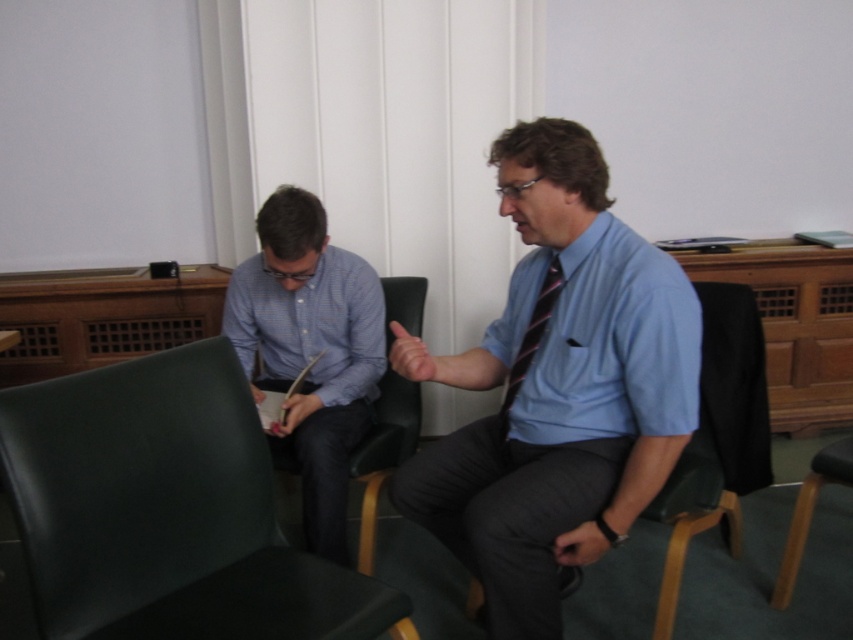
Question: Does matte black swivel chair at left have a larger size compared to black leather chair at center?

Choices:
 (A) yes
 (B) no

Answer: (B)

Question: Which of the following is the closest to the observer?

Choices:
 (A) (535, 189)
 (B) (512, 394)
 (C) (97, 588)
 (D) (363, 396)

Answer: (C)

Question: Which point is closer to the camera taking this photo?

Choices:
 (A) (305, 342)
 (B) (503, 360)
 (C) (279, 557)

Answer: (C)

Question: Considering the relative positions of blue smooth dress shirt at center and blue button-up shirt at center in the image provided, where is blue smooth dress shirt at center located with respect to blue button-up shirt at center?

Choices:
 (A) left
 (B) right

Answer: (B)

Question: Does blue striped shirt at left have a greater width compared to black leather chair at center?

Choices:
 (A) yes
 (B) no

Answer: (A)

Question: Based on their relative distances, which object is farther from the blue button-up shirt at center?

Choices:
 (A) matte black swivel chair at left
 (B) black leather chair at center
 (C) blue smooth dress shirt at center
 (D) striped fabric tie at center

Answer: (D)